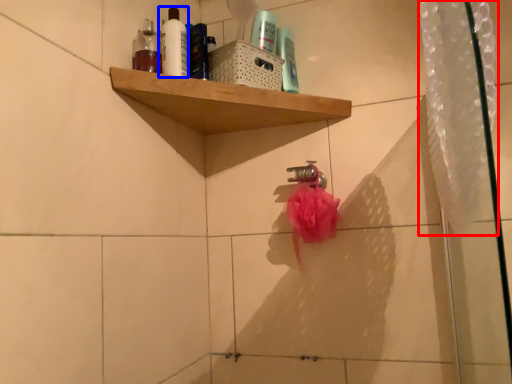
Question: Among these objects, which one is farthest to the camera, shower curtain (highlighted by a red box) or mouthwash (highlighted by a blue box)?

Choices:
 (A) shower curtain
 (B) mouthwash

Answer: (B)